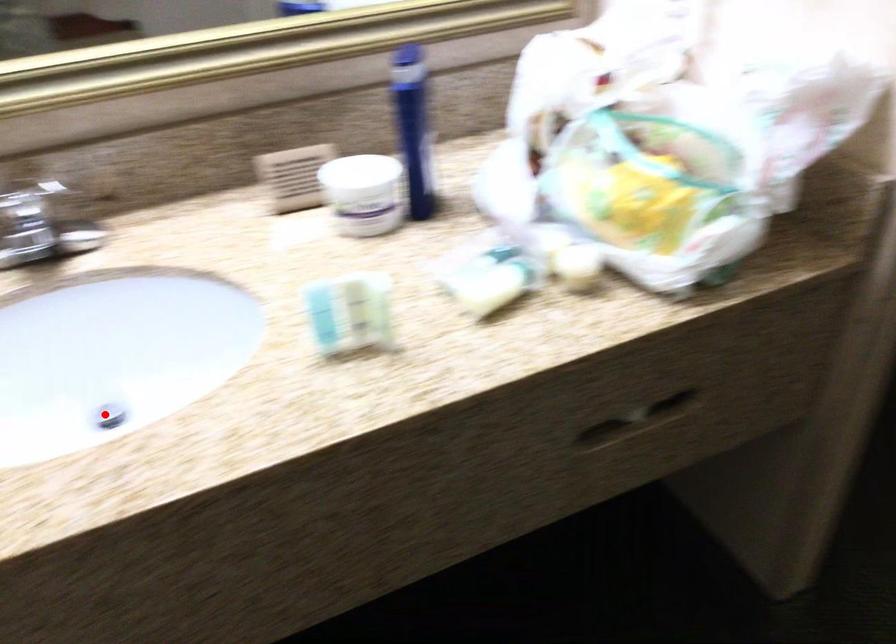
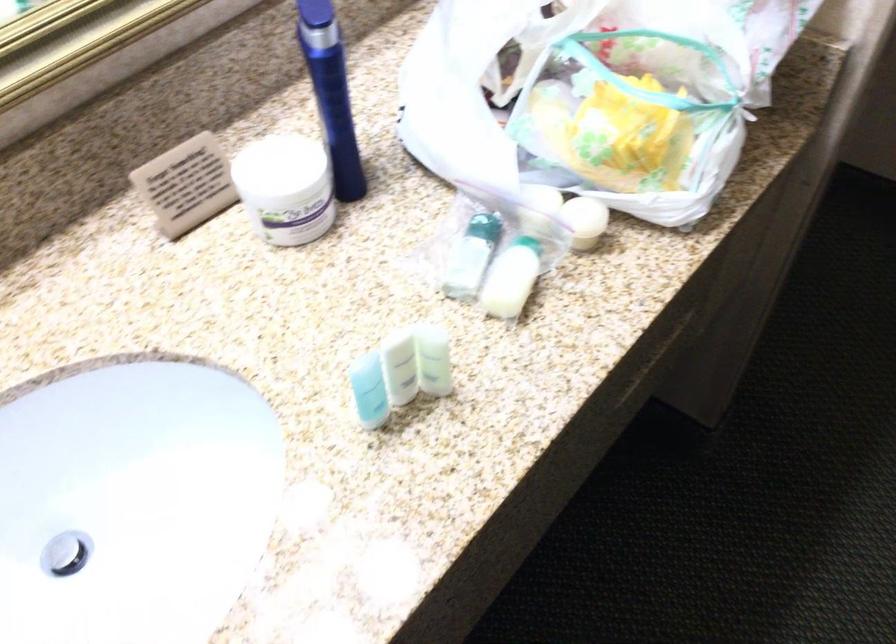
Question: A red point is marked in image1. In image2, is the corresponding 3D point closer to the camera or farther? Reply with the corresponding letter.

Choices:
 (A) The corresponding 3D point is closer.
 (B) The corresponding 3D point is farther.

Answer: (A)